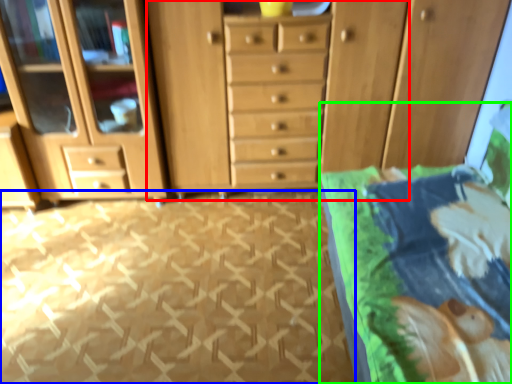
Question: Which is nearer to the dresser (highlighted by a red box)? tile (highlighted by a blue box) or bed (highlighted by a green box).

Choices:
 (A) tile
 (B) bed

Answer: (A)